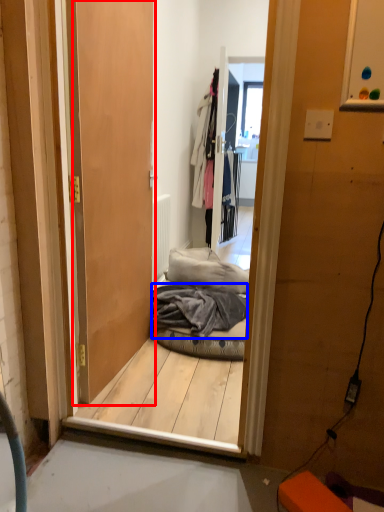
Question: Which object appears farthest to the camera in this image, door (highlighted by a red box) or material (highlighted by a blue box)?

Choices:
 (A) door
 (B) material

Answer: (B)